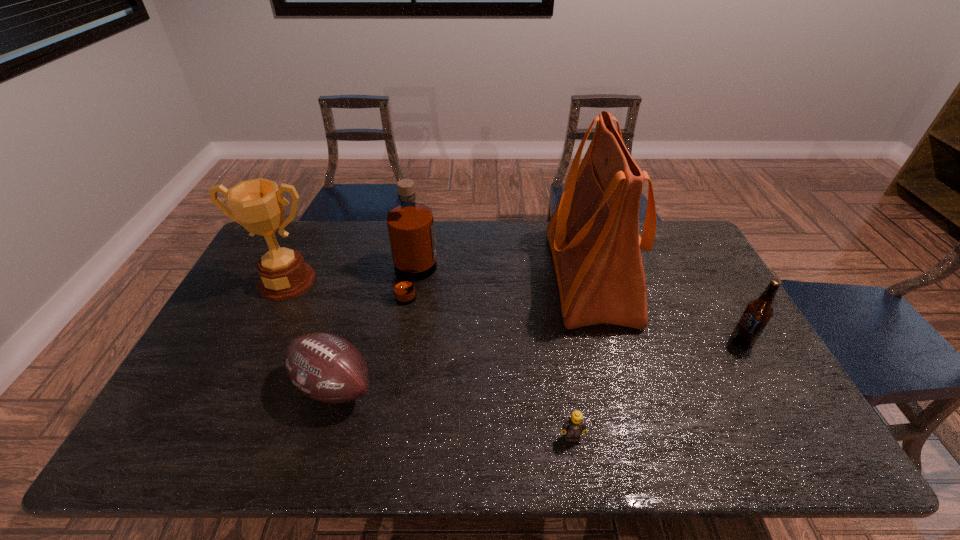
You are a GUI agent. You are given a task and a screenshot of the screen. Output one action in this format:
    pyautogui.click(x=<x>, y=<y>)
    Task: Click on the vacant space that satisfies the following two spatial constraints: 1. on the front pocket of the shopping bag; 2. on the front-facing side of the award
    This screenshot has height=540, width=960.
    Given the screenshot: What is the action you would take?
    pyautogui.click(x=591, y=281)